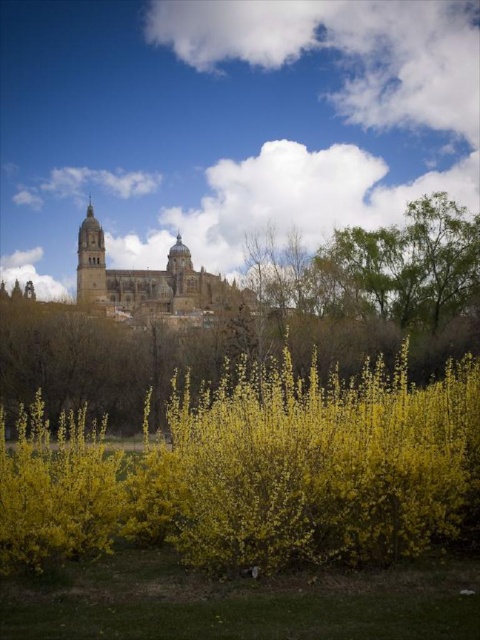
Question: Estimate the real-world distances between objects in this image. Which object is farther from the smooth stone tower at upper left?

Choices:
 (A) brown stone tower at center
 (B) yellow matte flower at lower center

Answer: (B)

Question: Which point appears closest to the camera in this image?

Choices:
 (A) (127, 316)
 (B) (91, 266)
 (C) (38, 536)

Answer: (C)

Question: Can you confirm if yellow matte flower at lower center is positioned to the left of brown stone tower at center?

Choices:
 (A) no
 (B) yes

Answer: (A)

Question: Considering the relative positions of yellow matte flower at lower center and smooth stone tower at upper left in the image provided, where is yellow matte flower at lower center located with respect to smooth stone tower at upper left?

Choices:
 (A) below
 (B) above

Answer: (A)

Question: Is yellow matte flower at lower center positioned in front of smooth stone tower at upper left?

Choices:
 (A) yes
 (B) no

Answer: (A)

Question: Which point is farther to the camera?

Choices:
 (A) smooth stone tower at upper left
 (B) brown stone tower at center

Answer: (A)